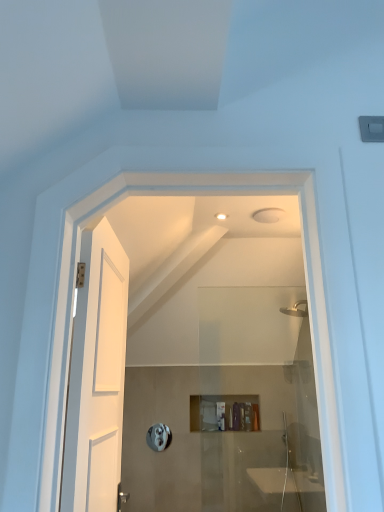
Question: Can you confirm if white wooden door at left is taller than translucent plastic container at center, the 2th toiletry viewed from the right?

Choices:
 (A) no
 (B) yes

Answer: (B)

Question: Could you tell me if white wooden door at left is facing translucent plastic container at center, the 2th toiletry viewed from the right?

Choices:
 (A) no
 (B) yes

Answer: (A)

Question: Does white wooden door at left lie behind translucent plastic container at center, which is counted as the first toiletry, starting from the left?

Choices:
 (A) no
 (B) yes

Answer: (A)

Question: Can you confirm if white wooden door at left is thinner than translucent plastic container at center, the 2th toiletry viewed from the right?

Choices:
 (A) no
 (B) yes

Answer: (A)

Question: Is white wooden door at left shorter than translucent plastic container at center, which is counted as the first toiletry, starting from the left?

Choices:
 (A) no
 (B) yes

Answer: (A)

Question: From the image's perspective, does white wooden door at left appear lower than translucent plastic container at center, the 2th toiletry viewed from the right?

Choices:
 (A) yes
 (B) no

Answer: (B)

Question: Does translucent plastic container at center, the 2th toiletry viewed from the right, appear on the left side of silver metallic towel bar at center?

Choices:
 (A) no
 (B) yes

Answer: (A)

Question: From a real-world perspective, is translucent plastic container at center, the 2th toiletry viewed from the right, located higher than silver metallic towel bar at center?

Choices:
 (A) no
 (B) yes

Answer: (B)

Question: Does translucent plastic container at center, the 2th toiletry viewed from the right, appear on the right side of silver metallic towel bar at center?

Choices:
 (A) no
 (B) yes

Answer: (B)

Question: Does translucent plastic container at center, which is counted as the first toiletry, starting from the left, lie behind silver metallic towel bar at center?

Choices:
 (A) no
 (B) yes

Answer: (B)

Question: Does translucent plastic container at center, which is counted as the first toiletry, starting from the left, have a greater height compared to silver metallic towel bar at center?

Choices:
 (A) yes
 (B) no

Answer: (B)

Question: Does translucent plastic container at center, the 2th toiletry viewed from the right, have a lesser height compared to silver metallic towel bar at center?

Choices:
 (A) no
 (B) yes

Answer: (B)

Question: Is white wooden door at left outside matte plastic toiletry at center, the first toiletry positioned from the right?

Choices:
 (A) no
 (B) yes

Answer: (B)